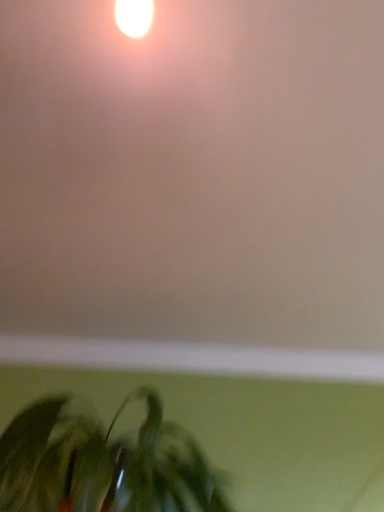
Question: Would you say green matte plant at lower left is to the left or to the right of matte white wall at upper center in the picture?

Choices:
 (A) right
 (B) left

Answer: (B)

Question: From a real-world perspective, is green matte plant at lower left positioned above or below matte white wall at upper center?

Choices:
 (A) below
 (B) above

Answer: (A)

Question: From the image's perspective, is green matte plant at lower left above or below matte white wall at upper center?

Choices:
 (A) above
 (B) below

Answer: (B)

Question: Considering the positions of point (167, 263) and point (28, 509), is point (167, 263) closer or farther from the camera than point (28, 509)?

Choices:
 (A) closer
 (B) farther

Answer: (B)

Question: In terms of size, does matte white wall at upper center appear bigger or smaller than green matte plant at lower left?

Choices:
 (A) big
 (B) small

Answer: (B)

Question: Considering the relative positions of matte white wall at upper center and green matte plant at lower left in the image provided, is matte white wall at upper center to the left or to the right of green matte plant at lower left?

Choices:
 (A) right
 (B) left

Answer: (A)

Question: Considering the positions of matte white wall at upper center and green matte plant at lower left in the image, is matte white wall at upper center wider or thinner than green matte plant at lower left?

Choices:
 (A) wide
 (B) thin

Answer: (A)